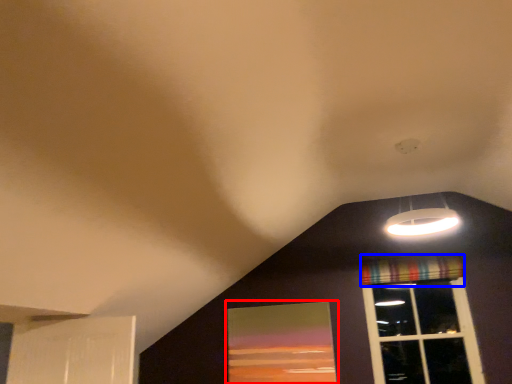
Question: Which object appears closest to the camera in this image, window screen (highlighted by a red box) or curtain (highlighted by a blue box)?

Choices:
 (A) window screen
 (B) curtain

Answer: (A)